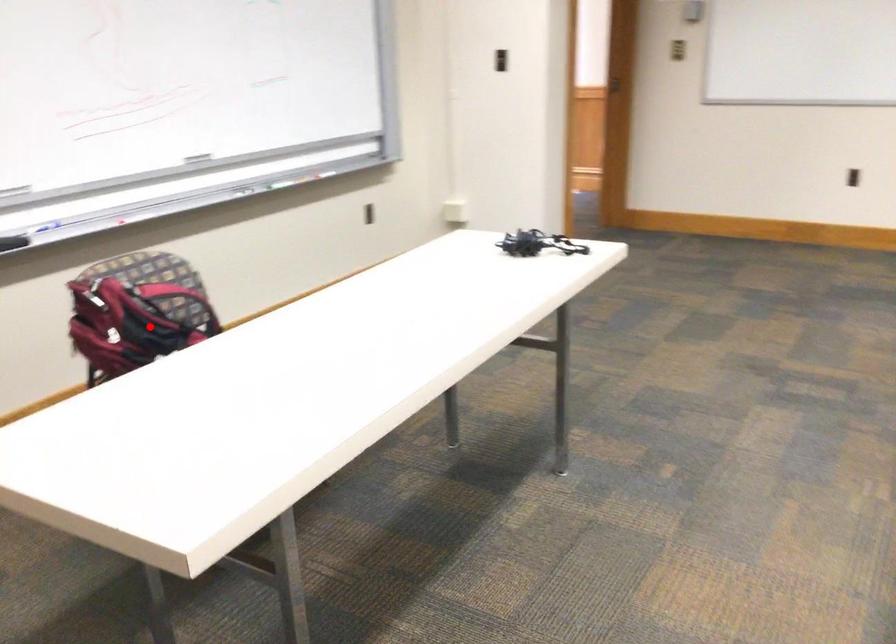
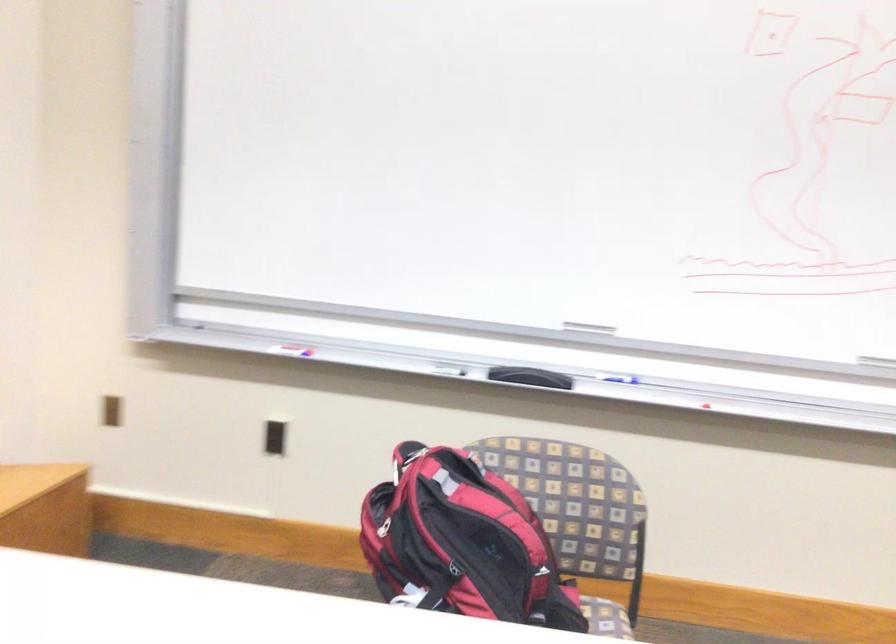
In the second image, find the point that corresponds to the highlighted location in the first image.

(478, 542)